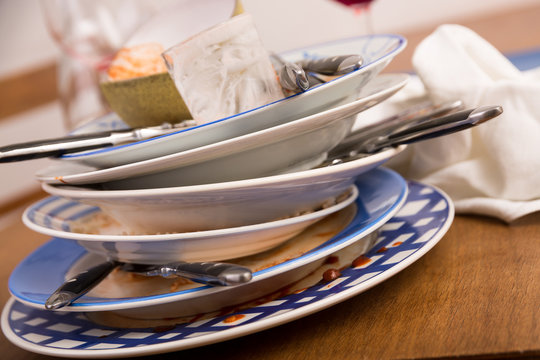
At what (x,y) coordinates should I click in order to perform the action: click on utensils. Please return your answer as a coordinate pair (x, y). Looking at the image, I should click on (461, 125), (338, 62), (64, 143), (449, 108), (225, 268), (73, 284), (300, 78).